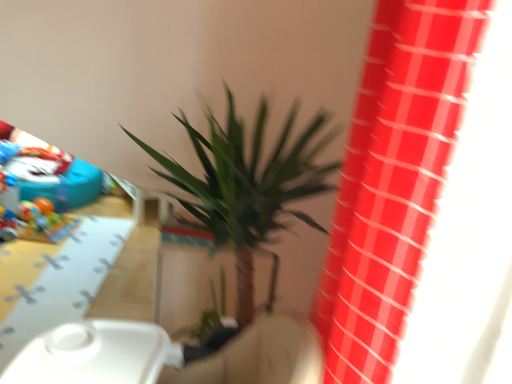
Question: Can you confirm if glossy plastic curtain at upper right is smaller than green leafy plant at center?

Choices:
 (A) no
 (B) yes

Answer: (B)

Question: Considering the relative positions of glossy plastic curtain at upper right and green leafy plant at center in the image provided, is glossy plastic curtain at upper right to the left of green leafy plant at center from the viewer's perspective?

Choices:
 (A) yes
 (B) no

Answer: (B)

Question: Can you confirm if glossy plastic curtain at upper right is taller than green leafy plant at center?

Choices:
 (A) no
 (B) yes

Answer: (A)

Question: From a real-world perspective, is glossy plastic curtain at upper right positioned over green leafy plant at center based on gravity?

Choices:
 (A) yes
 (B) no

Answer: (A)

Question: Can you confirm if glossy plastic curtain at upper right is thinner than green leafy plant at center?

Choices:
 (A) no
 (B) yes

Answer: (B)

Question: Is glossy plastic curtain at upper right bigger than green leafy plant at center?

Choices:
 (A) yes
 (B) no

Answer: (B)

Question: Is glossy plastic curtain at upper right surrounded by yellow matte table at lower left?

Choices:
 (A) yes
 (B) no

Answer: (B)

Question: Is yellow matte table at lower left touching glossy plastic curtain at upper right?

Choices:
 (A) no
 (B) yes

Answer: (A)

Question: From the image's perspective, is yellow matte table at lower left located beneath glossy plastic curtain at upper right?

Choices:
 (A) no
 (B) yes

Answer: (B)

Question: Is yellow matte table at lower left oriented away from glossy plastic curtain at upper right?

Choices:
 (A) no
 (B) yes

Answer: (A)

Question: Is yellow matte table at lower left completely or partially outside of glossy plastic curtain at upper right?

Choices:
 (A) no
 (B) yes

Answer: (B)

Question: Does yellow matte table at lower left have a lesser width compared to glossy plastic curtain at upper right?

Choices:
 (A) yes
 (B) no

Answer: (B)

Question: From the image's perspective, would you say yellow matte table at lower left is shown under green leafy plant at center?

Choices:
 (A) no
 (B) yes

Answer: (B)